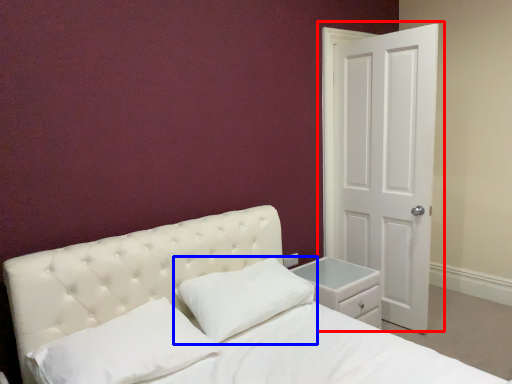
Question: Which point is closer to the camera, door (highlighted by a red box) or pillow (highlighted by a blue box)?

Choices:
 (A) door
 (B) pillow

Answer: (B)